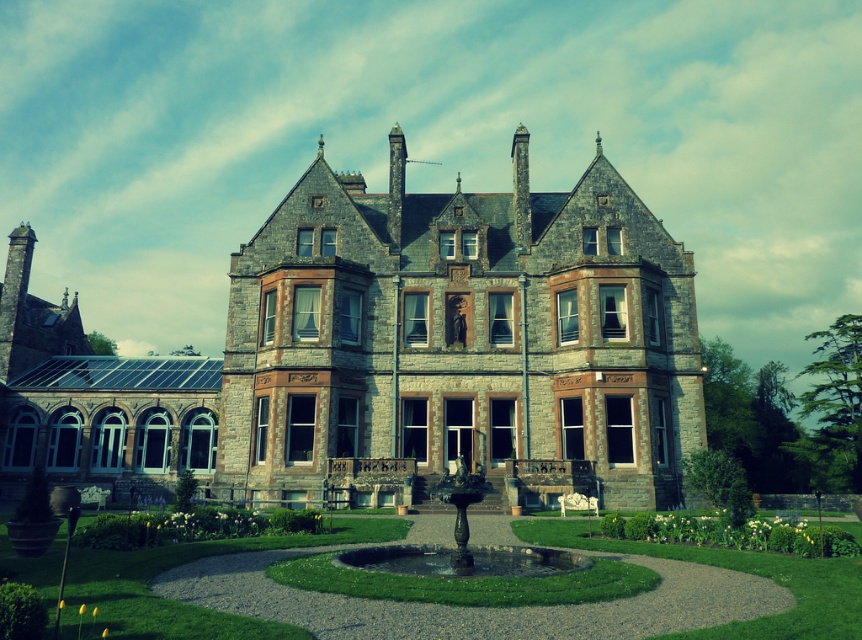
Based on the photo, you are standing in a large open field and see the stone mansion at center. If you were to walk directly towards the mansion, which direction should you head?

Since the stone mansion at center is located at point coordinates of (458, 337), you should walk directly towards the center of the field to reach it.